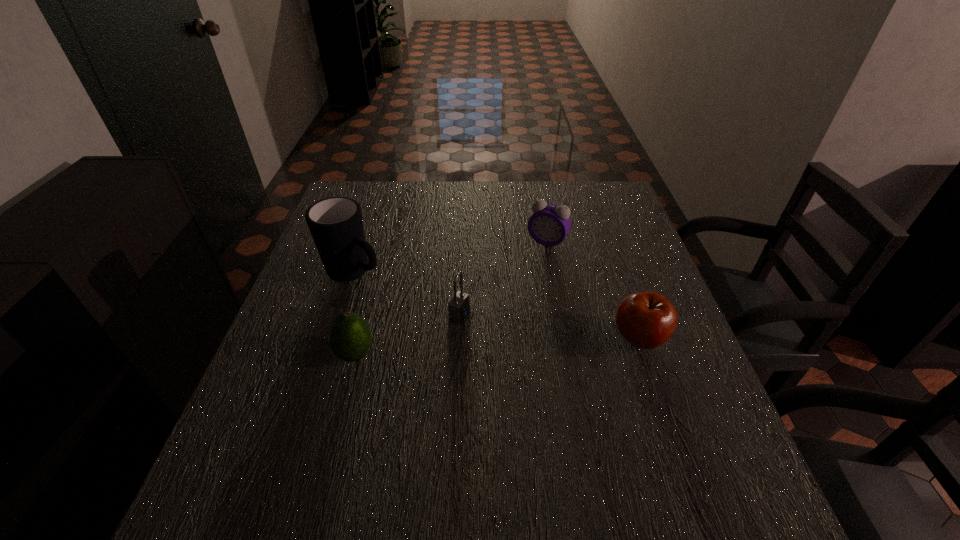
The height and width of the screenshot is (540, 960). I want to click on object positioned at the right edge, so click(647, 320).

You are a GUI agent. You are given a task and a screenshot of the screen. Output one action in this format:
    pyautogui.click(x=<x>, y=<y>)
    Task: Click on the free location at the far edge of the desktop
    This screenshot has height=540, width=960.
    Given the screenshot: What is the action you would take?
    pyautogui.click(x=420, y=197)

In the image, there is a desktop. Identify the location of vacant space at the near edge. Image resolution: width=960 pixels, height=540 pixels. (561, 457).

This screenshot has width=960, height=540. In order to click on free region at the left edge in this screenshot , I will do `click(302, 368)`.

Image resolution: width=960 pixels, height=540 pixels. Find the location of `vacant space at the right edge`. vacant space at the right edge is located at coordinates (640, 373).

Where is `free space at the far right corner of the desktop`? Image resolution: width=960 pixels, height=540 pixels. free space at the far right corner of the desktop is located at coordinates (581, 195).

Identify the location of vacant area at the near right corner. (724, 428).

I want to click on vacant space that's between the apple and the padlock, so click(549, 327).

Locate an element on the screen. vacant area between the farthest object and the padlock is located at coordinates (503, 278).

Where is `vacant area that lies between the rightmost object and the second farthest object`? vacant area that lies between the rightmost object and the second farthest object is located at coordinates (496, 306).